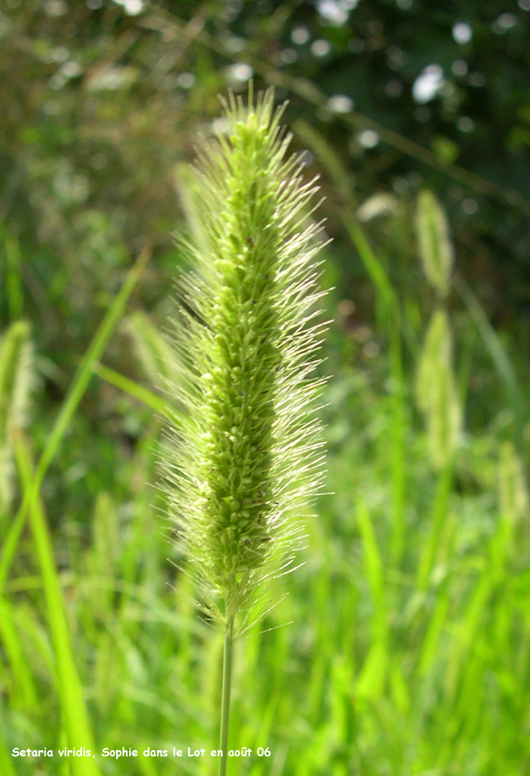
At what (x,y) coordinates should I click in order to perform the action: click on focused plant. Please return your answer as a coordinate pair (x, y). Image resolution: width=530 pixels, height=776 pixels. Looking at the image, I should click on pos(240,260), pos(233,456).